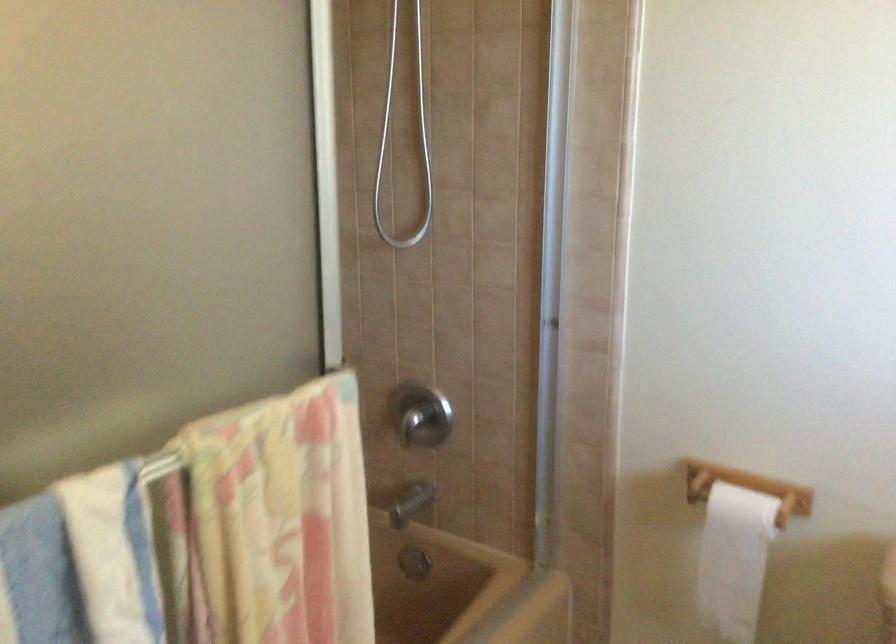
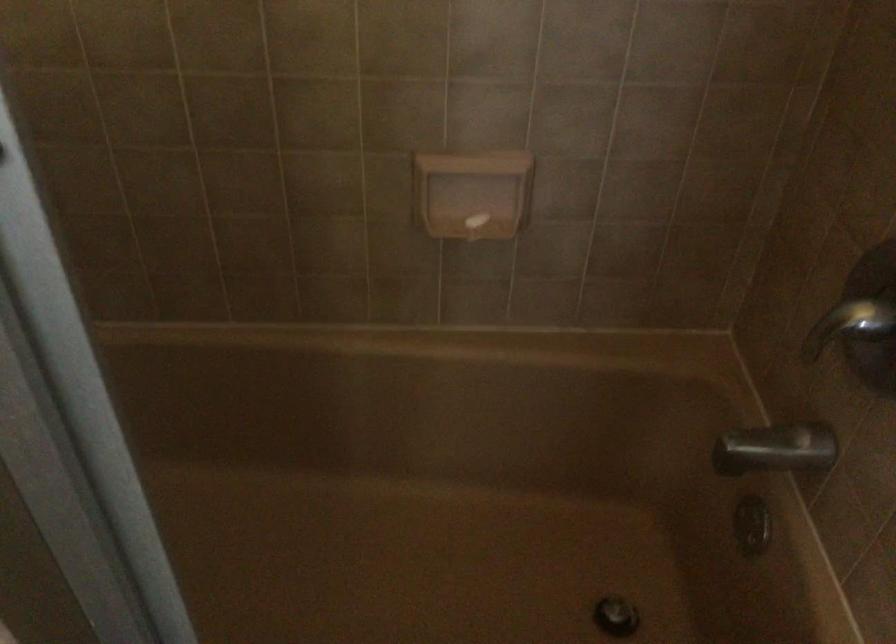
The point at (421, 424) is marked in the first image. Where is the corresponding point in the second image?

(849, 325)